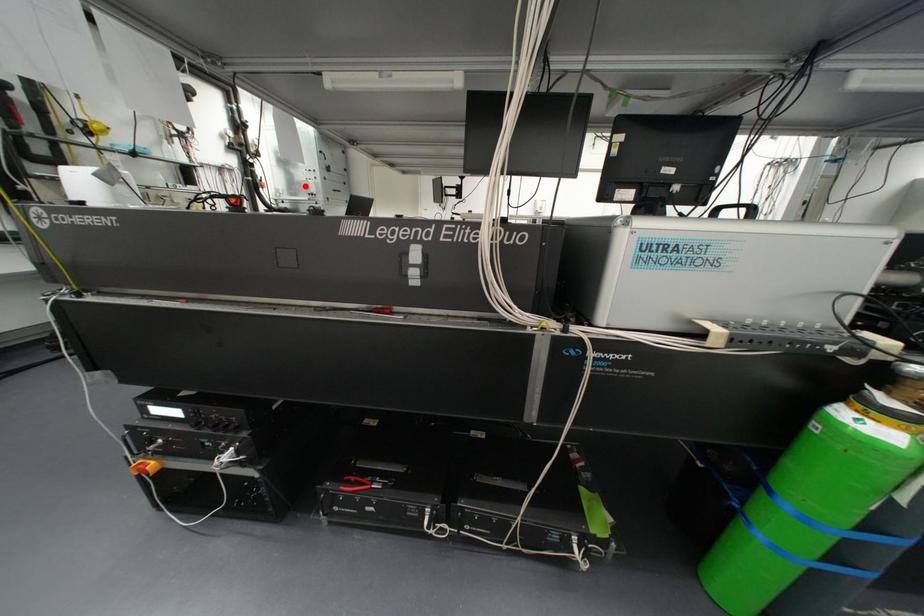
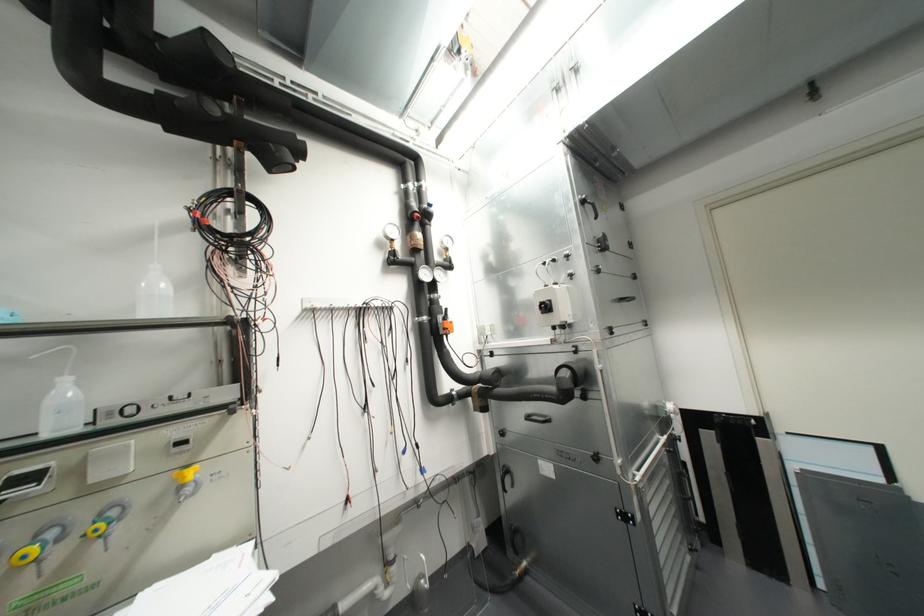
In the second image, find the point that corresponds to the highlighted location in the first image.

(545, 307)